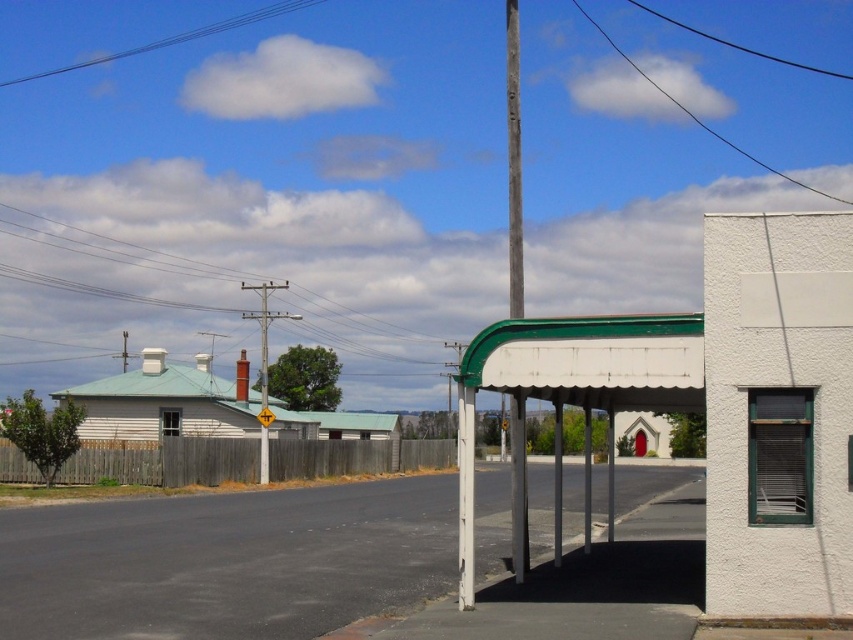
Is white matte canopy at center thinner than metallic wire at upper center?

Correct, white matte canopy at center's width is less than metallic wire at upper center's.

What do you see at coordinates (202, 406) in the screenshot? This screenshot has height=640, width=853. I see `white matte canopy at center` at bounding box center [202, 406].

Find the location of a particular element. This screenshot has width=853, height=640. white matte canopy at center is located at coordinates (202, 406).

Describe the element at coordinates (202, 406) in the screenshot. I see `white matte canopy at center` at that location.

Can you confirm if white matte canopy at center is thinner than clear blue wires at upper center?

Yes, white matte canopy at center is thinner than clear blue wires at upper center.

Does point (258, 397) come in front of point (57, 74)?

Yes, point (258, 397) is in front of point (57, 74).

Locate an element on the screen. white matte canopy at center is located at coordinates (202, 406).

Measure the distance from clear blue wires at upper center to black wire at upper center.

58.69 meters

The width and height of the screenshot is (853, 640). Describe the element at coordinates (177, 36) in the screenshot. I see `clear blue wires at upper center` at that location.

Does point (125, 52) come farther from viewer compared to point (695, 115)?

That is True.

Locate an element on the screen. clear blue wires at upper center is located at coordinates (177, 36).